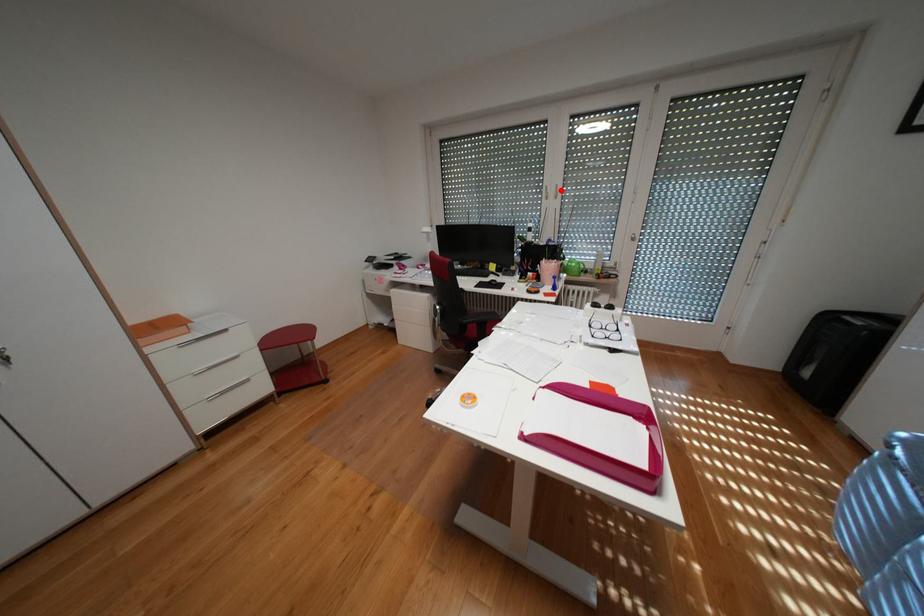
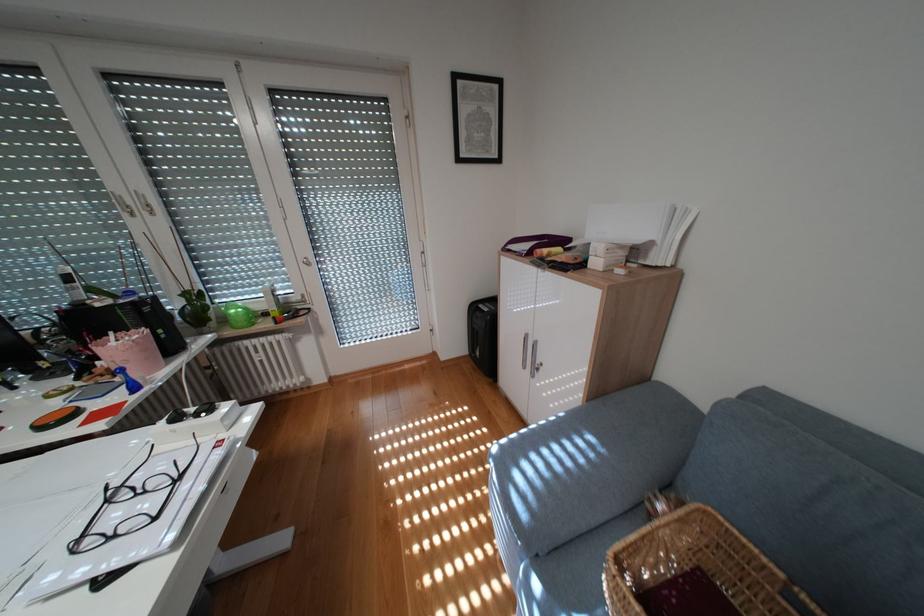
The point at the highlighted location is marked in the first image. Where is the corresponding point in the second image?

(141, 201)